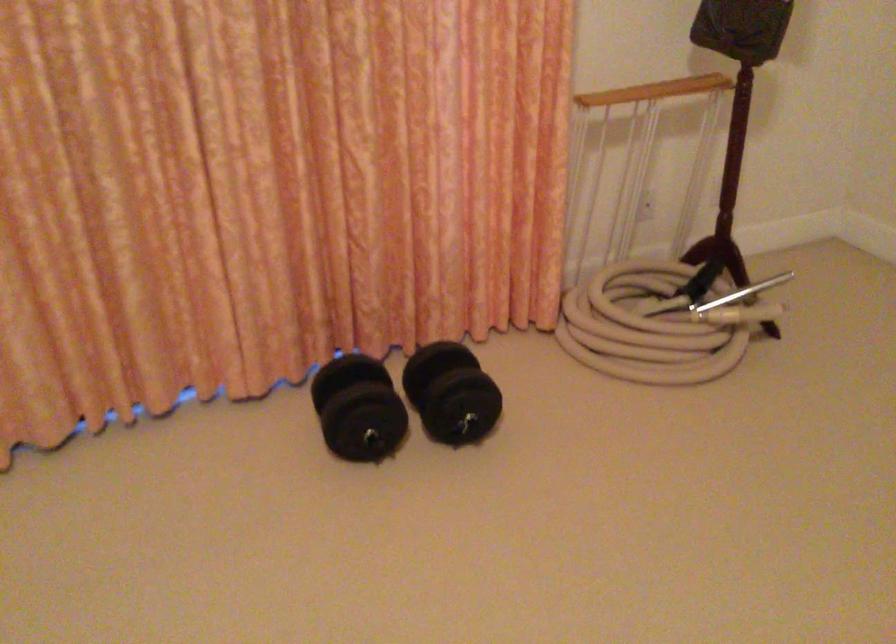
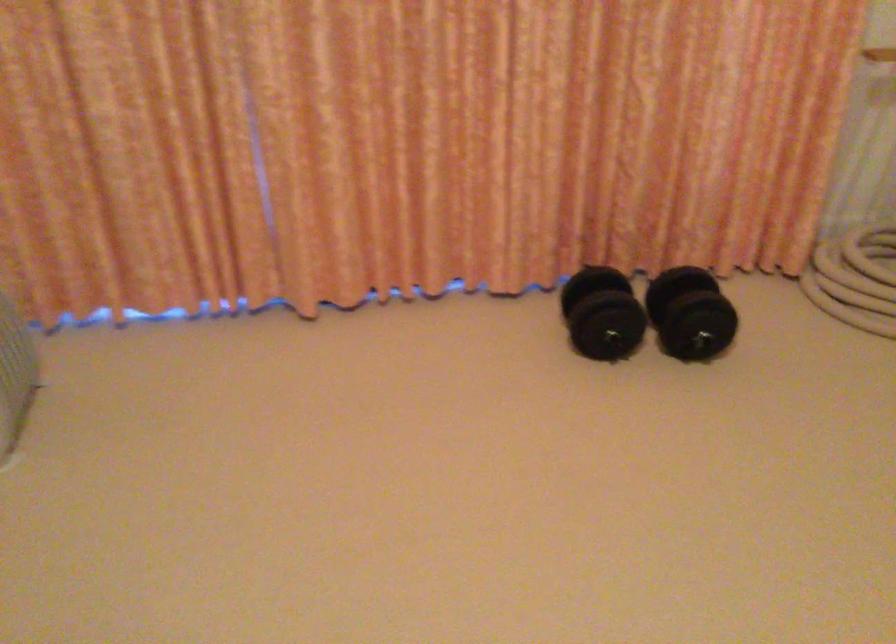
Find the pixel in the second image that matches [451,397] in the first image.

(690, 313)